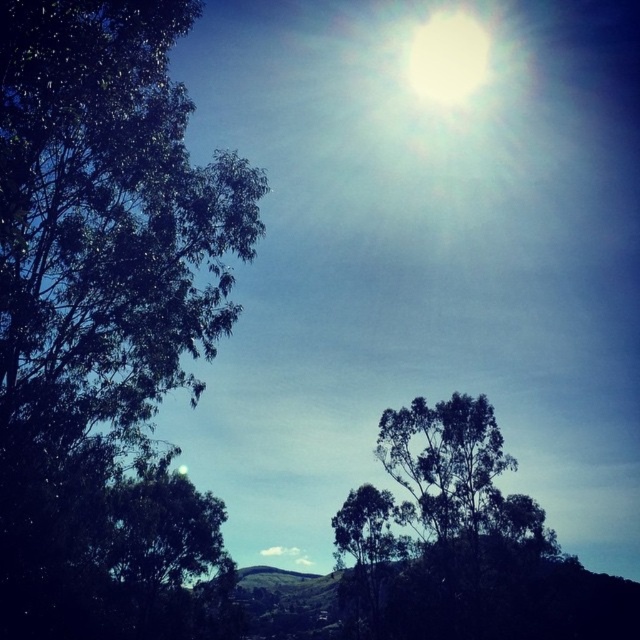
Is green leafy tree at left smaller than white glossy sun at upper center?

No.

Between green leafy tree at left and white glossy sun at upper center, which one is positioned lower?

green leafy tree at left

Between point (129, 74) and point (458, 44), which one is positioned behind?

Positioned behind is point (458, 44).

The image size is (640, 640). What are the coordinates of `green leafy tree at left` in the screenshot? It's located at (106, 323).

Does green leafy tree at center appear on the right side of white glossy sun at upper center?

In fact, green leafy tree at center is to the left of white glossy sun at upper center.

Is the position of green leafy tree at center less distant than that of white glossy sun at upper center?

Yes, green leafy tree at center is closer to the viewer.

I want to click on green leafy tree at center, so click(440, 531).

You are a GUI agent. You are given a task and a screenshot of the screen. Output one action in this format:
    pyautogui.click(x=<x>, y=<y>)
    Task: Click on the green leafy tree at center
    
    Given the screenshot: What is the action you would take?
    pyautogui.click(x=440, y=531)

Is green leafy tree at left taller than green leafy tree at center?

Indeed, green leafy tree at left has a greater height compared to green leafy tree at center.

Where is `green leafy tree at left`? This screenshot has width=640, height=640. green leafy tree at left is located at coordinates (106, 323).

Which is behind, point (56, 22) or point (540, 557)?

The point (540, 557) is more distant.

The width and height of the screenshot is (640, 640). In order to click on green leafy tree at left in this screenshot , I will do `click(106, 323)`.